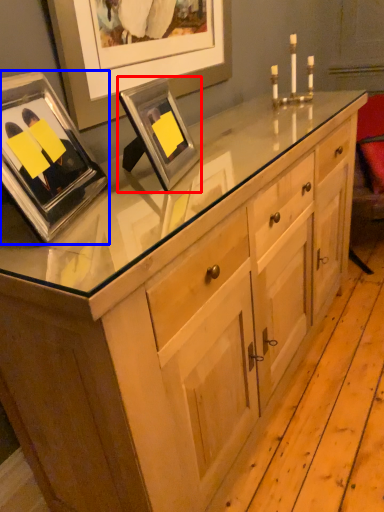
Question: Which point is further to the camera, picture frame (highlighted by a red box) or picture frame (highlighted by a blue box)?

Choices:
 (A) picture frame
 (B) picture frame

Answer: (A)